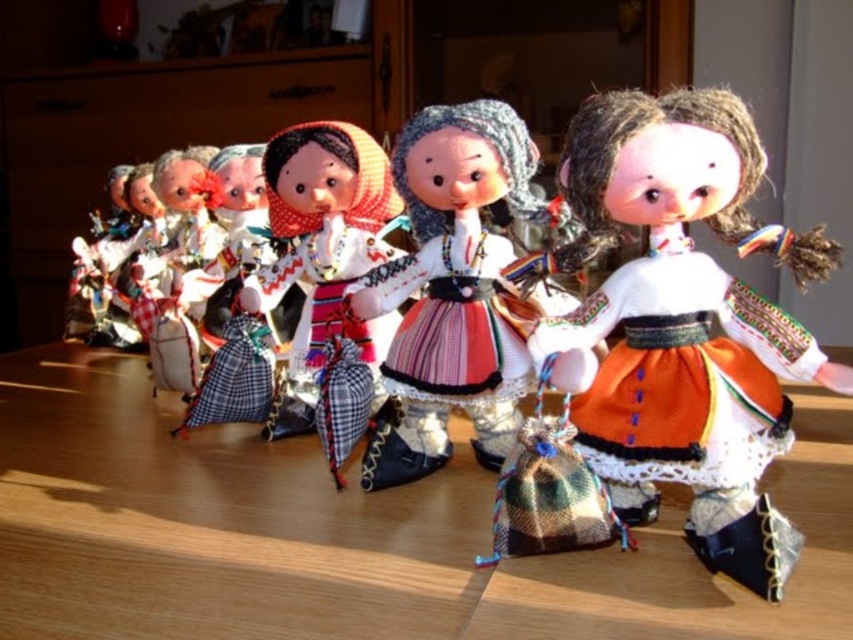
Is matte fabric doll at center above orange fabric skirt at center?

Yes.

Is point (531, 212) positioned in front of point (724, 301)?

No, (531, 212) is behind (724, 301).

Image resolution: width=853 pixels, height=640 pixels. I want to click on matte fabric doll at center, so click(451, 289).

Is orange fabric skirt at center closer to camera compared to multicolored fabric dress at center?

Yes, it is.

Can you confirm if orange fabric skirt at center is bigger than multicolored fabric dress at center?

Actually, orange fabric skirt at center might be smaller than multicolored fabric dress at center.

Between point (616, 305) and point (444, 314), which one is positioned behind?

The point (444, 314) is behind.

The image size is (853, 640). I want to click on orange fabric skirt at center, so click(682, 372).

In the scene shown: Which is more to the left, matte fabric doll at center or plaid fabric skirt at center?

From the viewer's perspective, plaid fabric skirt at center appears more on the left side.

Between matte fabric doll at center and plaid fabric skirt at center, which one is positioned higher?

Positioned higher is matte fabric doll at center.

Find the location of a particular element. The width and height of the screenshot is (853, 640). matte fabric doll at center is located at coordinates (451, 289).

Identify the location of matte fabric doll at center. The image size is (853, 640). (451, 289).